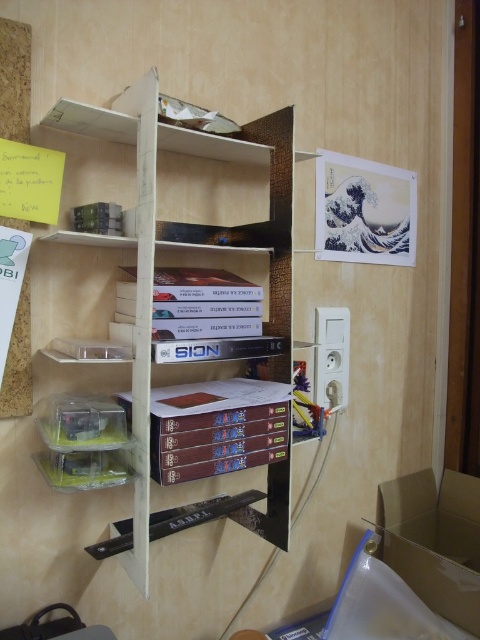
Consider the image. You are organizing books on a white matte bookshelf at center and need to place a hardcover book at center. Where should you place it relative to the existing books?

The white matte bookshelf at center is located above the hardcover book at center, so you should place the hardcover book at center below the existing books on the shelf.

You are standing in front of the cardboard shelving unit and want to reach both points mentioned. Which point, point [253,513] or point [189,465], is closer to your hand when you extend it forward?

Point [253,513] is further to the camera than point [189,465], so the point closer to your hand would be point [189,465].

You have a new book that is the same size as the white matte bookshelf at center. You want to place it on the cardboard box at lower right. Will it fit?

The white matte bookshelf at center has a larger size compared to cardboard box at lower right. Since the new book is the same size as the white matte bookshelf at center, it will not fit on the cardboard box at lower right which is smaller in size.